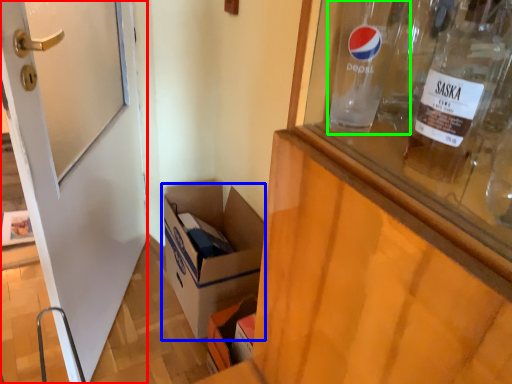
Question: Which is nearer to the door (highlighted by a red box)? box (highlighted by a blue box) or glass bottle (highlighted by a green box).

Choices:
 (A) box
 (B) glass bottle

Answer: (A)